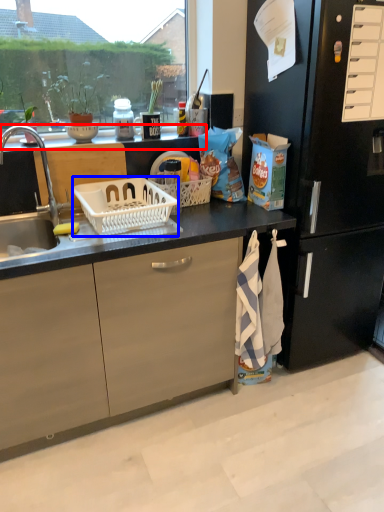
Question: Which object is further to the camera taking this photo, window sill (highlighted by a red box) or picnic basket (highlighted by a blue box)?

Choices:
 (A) window sill
 (B) picnic basket

Answer: (A)